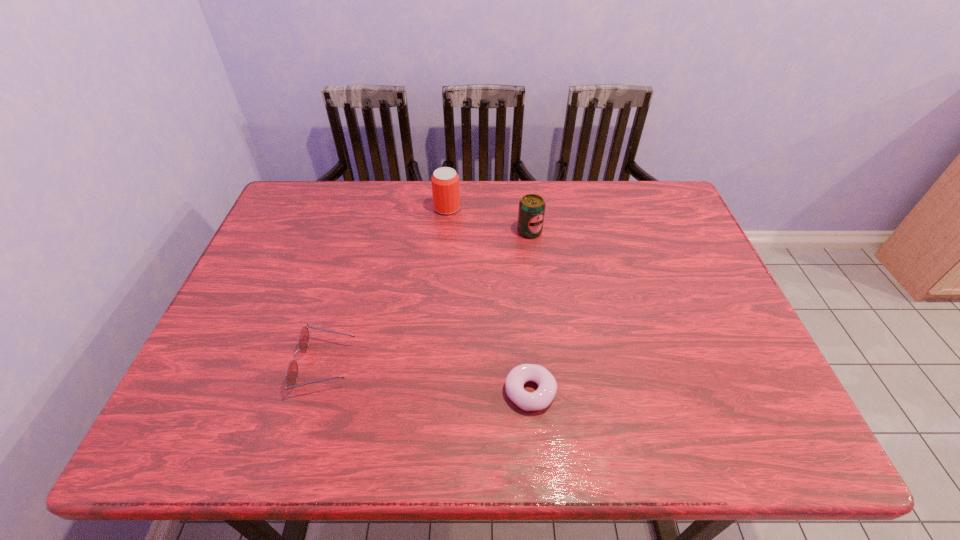
Where is `vacant area that satisfies the following two spatial constraints: 1. on the front side of the farther beer can; 2. on the left side of the doughnut`? vacant area that satisfies the following two spatial constraints: 1. on the front side of the farther beer can; 2. on the left side of the doughnut is located at coordinates (431, 392).

The width and height of the screenshot is (960, 540). I want to click on vacant space that satisfies the following two spatial constraints: 1. on the front-facing side of the doughnut; 2. on the left side of the third tallest object, so click(x=318, y=392).